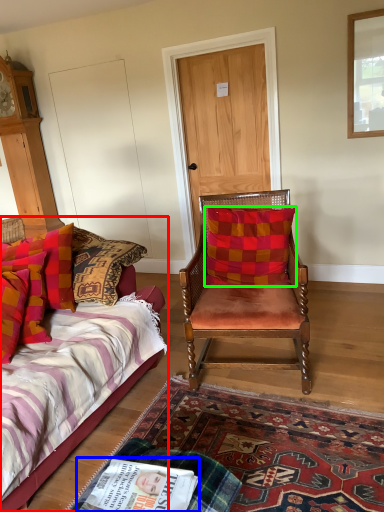
Question: Which object is positioned farthest from bed (highlighted by a red box)? Select from magazine (highlighted by a blue box) and pillow (highlighted by a green box).

Choices:
 (A) magazine
 (B) pillow

Answer: (B)